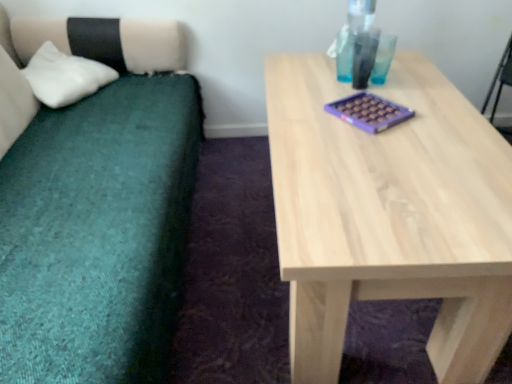
Question: Is natural wood table at center taller or shorter than teal fabric couch at left?

Choices:
 (A) tall
 (B) short

Answer: (B)

Question: Looking at the image, does natural wood table at center seem bigger or smaller compared to teal fabric couch at left?

Choices:
 (A) small
 (B) big

Answer: (A)

Question: Which object is the farthest from the teal fabric couch at left?

Choices:
 (A) natural wood table at center
 (B) white soft pillow at left

Answer: (A)

Question: Considering the real-world distances, which object is farthest from the white soft pillow at left?

Choices:
 (A) natural wood table at center
 (B) teal fabric couch at left

Answer: (A)